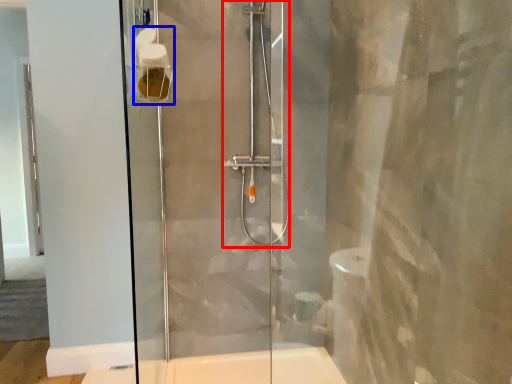
Question: Which point is closer to the camera, shower (highlighted by a red box) or toilet paper (highlighted by a blue box)?

Choices:
 (A) shower
 (B) toilet paper

Answer: (B)